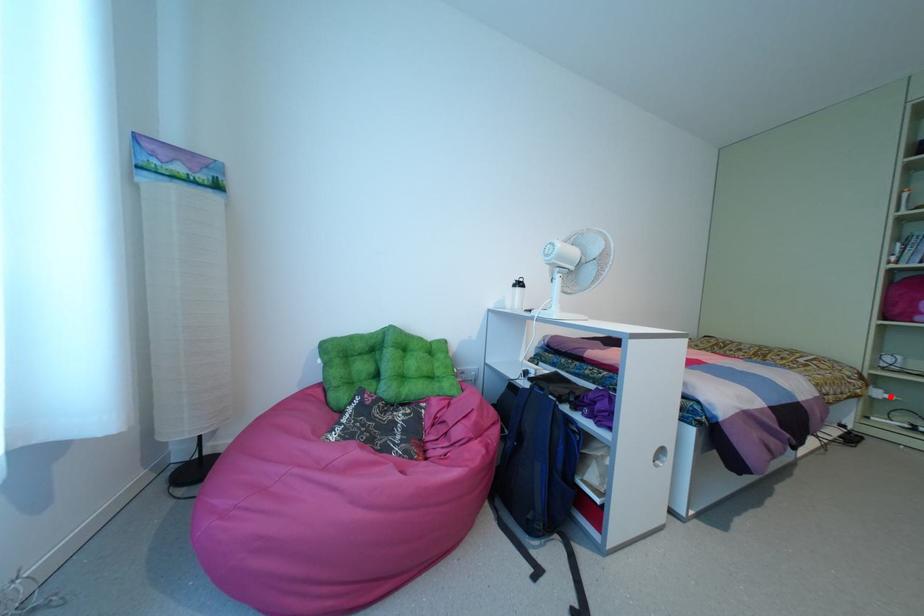
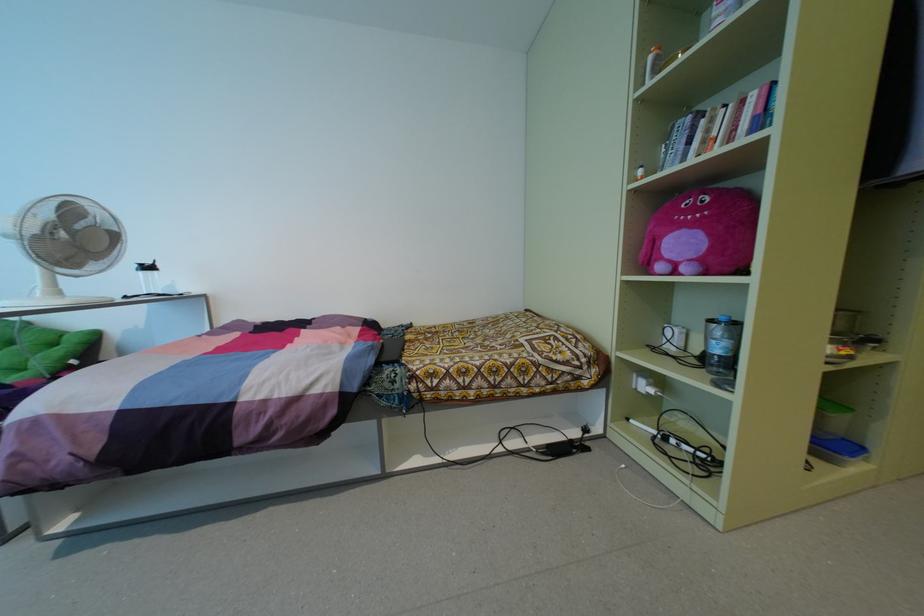
Question: I am providing you with two images of the same scene from different viewpoints. A red point is shown in image1. For the corresponding object point in image2, is it positioned nearer or farther from the camera?

Choices:
 (A) Nearer
 (B) Farther

Answer: (A)